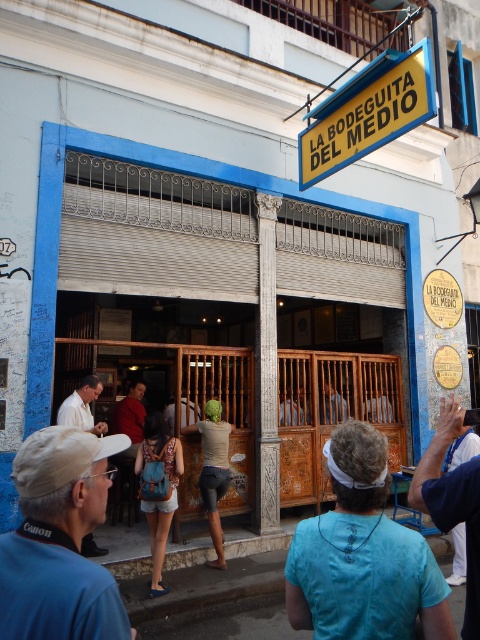
You are a photographer standing outside La Bodeguita del Medio in Havana. You notice two items at the center of the scene. Which one is on the left side? Please choose between the denim shorts at center and the light brown textured shirt at center.

The denim shorts at center is positioned on the left side of light brown textured shirt at center, so the denim shorts at center is on the left.

In the scene shown: You are a tourist standing outside the entrance of La Bodeguita del Medio in Havana, Cuba. You see a blue fabric shirt at center and a light brown wooden door at center. Which object is closer to your left side?

The blue fabric shirt at center is positioned on the left side of light brown wooden door at center, so the blue fabric shirt at center is closer to your left side.